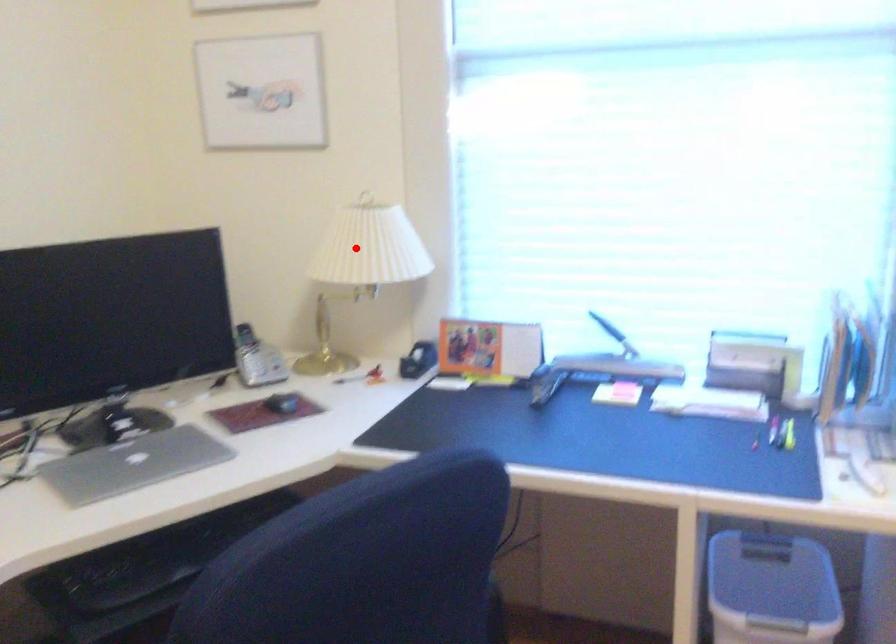
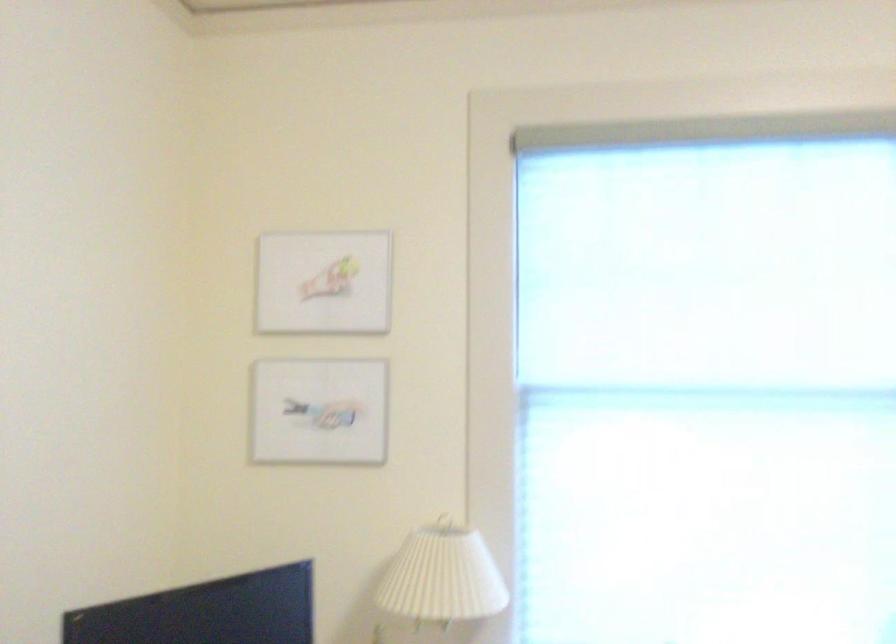
In the second image, find the point that corresponds to the highlighted location in the first image.

(443, 576)